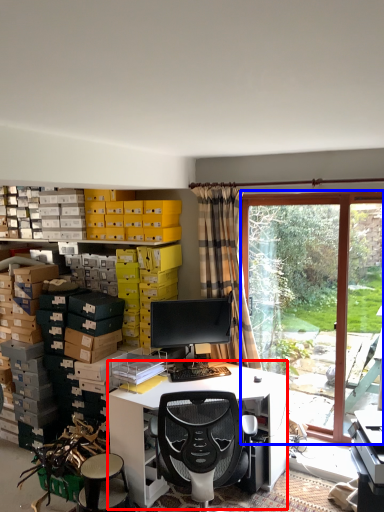
Question: Which object appears farthest to the camera in this image, desk (highlighted by a red box) or bay window (highlighted by a blue box)?

Choices:
 (A) desk
 (B) bay window

Answer: (B)